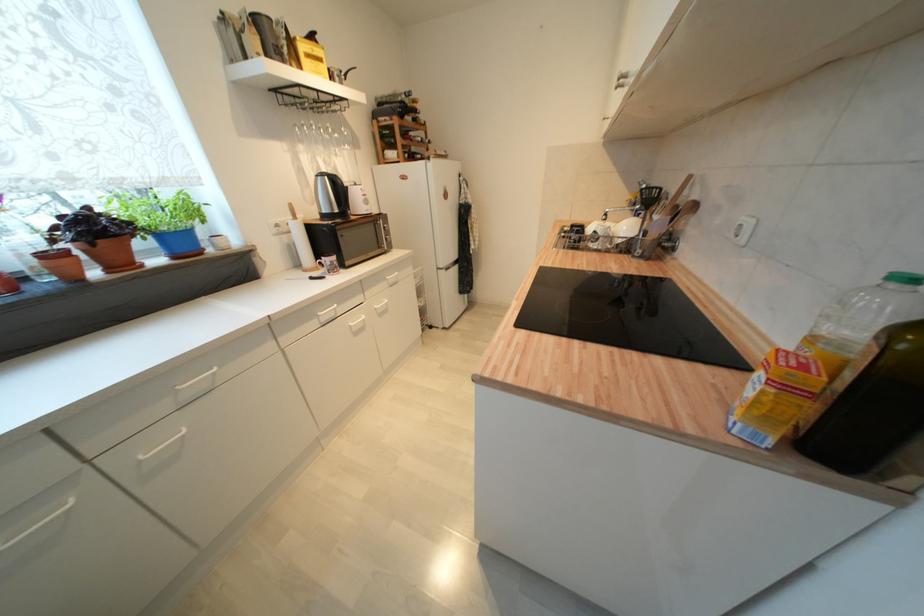
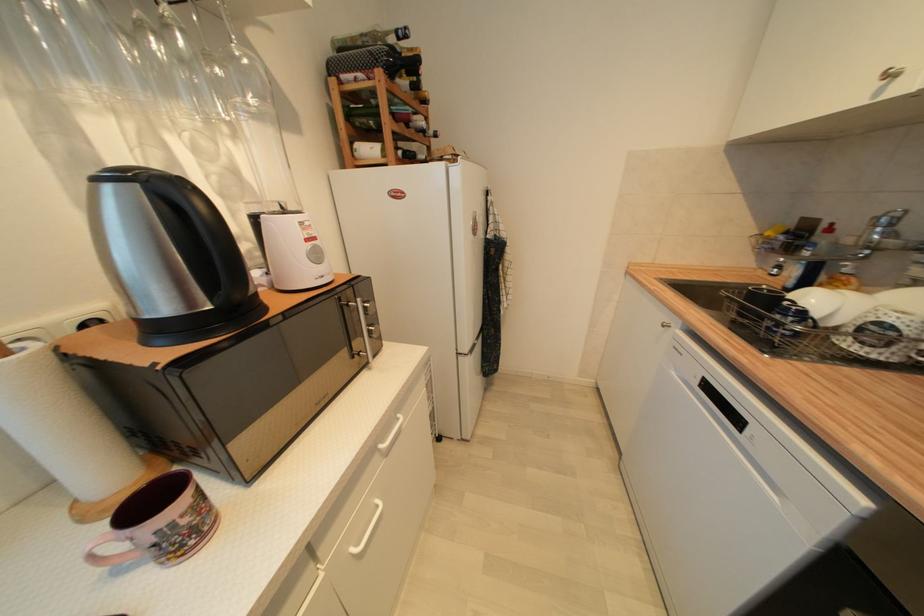
Looking at this image, which direction would the cameraman need to move to produce the second image?

The movement direction of the cameraman is left, forward.